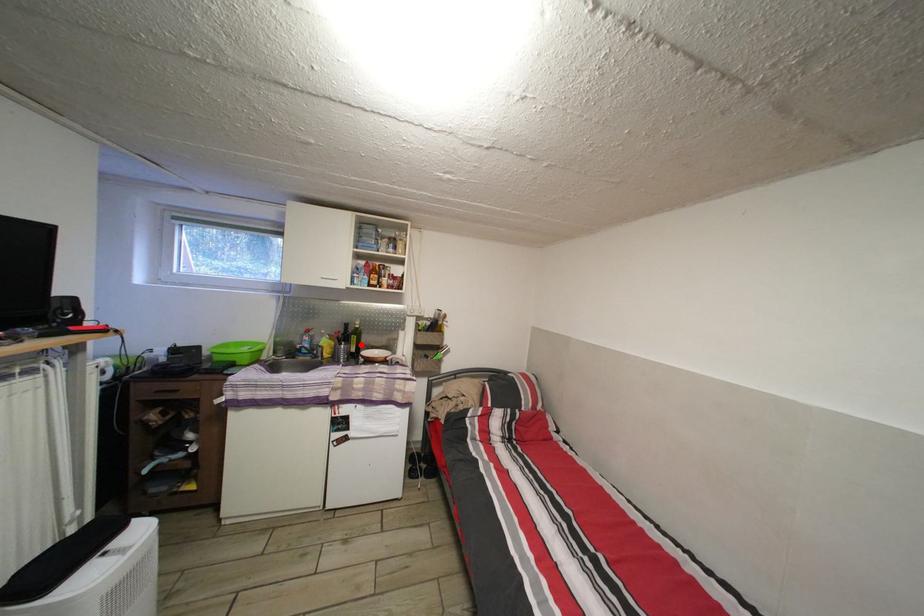
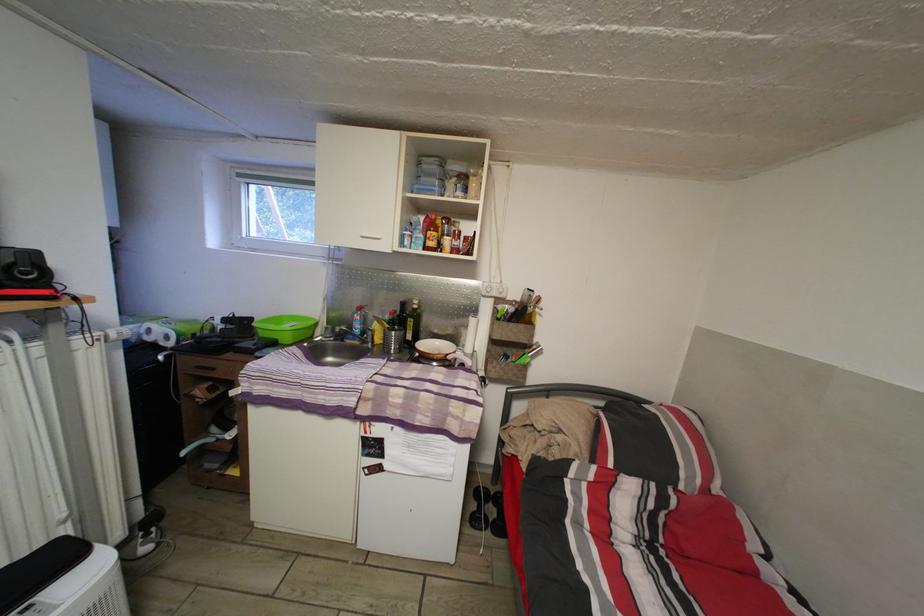
Where in the second image is the point corresponding to the highlighted location from the first image?

(418, 329)